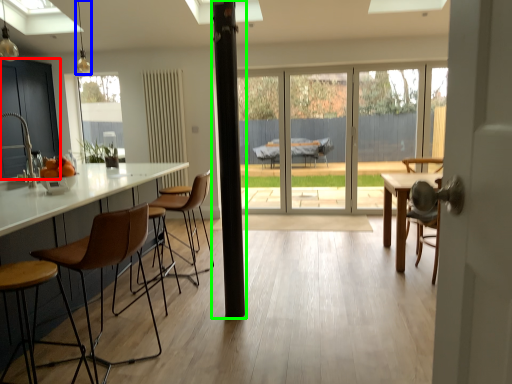
Question: Based on their relative distances, which object is farther from cabinetry (highlighted by a red box)? Choose from light fixture (highlighted by a blue box) and pillar (highlighted by a green box).

Choices:
 (A) light fixture
 (B) pillar

Answer: (B)